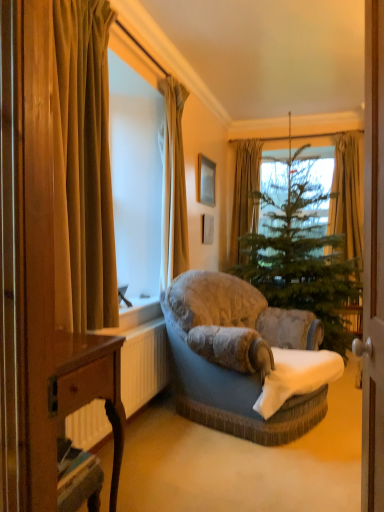
What is the approximate width of velvet gold curtain at left, arranged as the 4th curtain when viewed from the right?

velvet gold curtain at left, arranged as the 4th curtain when viewed from the right, is 20.82 centimeters wide.

This screenshot has width=384, height=512. What do you see at coordinates (142, 361) in the screenshot? I see `white plastic radiator at lower left` at bounding box center [142, 361].

What is the approximate width of wooden desk at lower left?

wooden desk at lower left is 13.41 inches wide.

Where is `green fabric curtain at upper right, which is the first curtain from right to left`? This screenshot has height=512, width=384. green fabric curtain at upper right, which is the first curtain from right to left is located at coordinates (348, 195).

Find the location of a particular element. green textured christmas tree at center is located at coordinates (302, 258).

Image resolution: width=384 pixels, height=512 pixels. Identify the location of velvet gold curtain at left, marked as the first curtain in a left-to-right arrangement. (83, 168).

Between wooden picture frame at upper center and white plastic radiator at lower left, which one has smaller width?

Thinner between the two is wooden picture frame at upper center.

Would you consider wooden picture frame at upper center to be distant from white plastic radiator at lower left?

That's right, there is a large distance between wooden picture frame at upper center and white plastic radiator at lower left.

Is wooden picture frame at upper center oriented away from white plastic radiator at lower left?

That's not correct — wooden picture frame at upper center is not looking away from white plastic radiator at lower left.

In the scene shown: Can you tell me how much wooden picture frame at upper center and white plastic radiator at lower left differ in facing direction?

wooden picture frame at upper center and white plastic radiator at lower left are facing 0.899 degrees away from each other.

In terms of height, does green fabric curtain at upper right, arranged as the 2th curtain when viewed from the back, look taller or shorter compared to green textured christmas tree at center?

Considering their sizes, green fabric curtain at upper right, arranged as the 2th curtain when viewed from the back, has less height than green textured christmas tree at center.

Is green fabric curtain at upper right, the 4th curtain when ordered from left to right, touching green textured christmas tree at center?

green fabric curtain at upper right, the 4th curtain when ordered from left to right, and green textured christmas tree at center are clearly separated.

From a real-world perspective, is green fabric curtain at upper right, which is the first curtain from right to left, under green textured christmas tree at center?

Incorrect, from a real-world perspective, green fabric curtain at upper right, which is the first curtain from right to left, is higher than green textured christmas tree at center.

Considering the sizes of green fabric curtain at upper center, the first curtain positioned from the back, and wooden desk at lower left in the image, is green fabric curtain at upper center, the first curtain positioned from the back, taller or shorter than wooden desk at lower left?

Answer: Clearly, green fabric curtain at upper center, the first curtain positioned from the back, is taller compared to wooden desk at lower left.

Is green fabric curtain at upper center, the third curtain positioned from the left, positioned with its back to wooden desk at lower left?

No, green fabric curtain at upper center, the third curtain positioned from the left, is not facing the opposite direction of wooden desk at lower left.

Choose the correct answer: Is green fabric curtain at upper center, placed as the second curtain when sorted from right to left, inside wooden desk at lower left or outside it?

green fabric curtain at upper center, placed as the second curtain when sorted from right to left, exists outside the volume of wooden desk at lower left.

Who is shorter, white plastic radiator at lower left or velvet gold curtain at left, the fourth curtain viewed from the back?

white plastic radiator at lower left is shorter.

Is velvet gold curtain at left, the fourth curtain viewed from the back, located within white plastic radiator at lower left?

No, velvet gold curtain at left, the fourth curtain viewed from the back, is located outside of white plastic radiator at lower left.

Which is closer to the camera, (x=163, y=381) or (x=67, y=138)?

The point (x=67, y=138) is in front.

Between white plastic radiator at lower left and velvet gold curtain at left, the fourth curtain viewed from the back, which one has larger size?

Bigger between the two is velvet gold curtain at left, the fourth curtain viewed from the back.

From the image's perspective, which is below, silky beige curtain at upper center, which is the second curtain in left-to-right order, or velvet gold curtain at left, arranged as the 4th curtain when viewed from the right?

velvet gold curtain at left, arranged as the 4th curtain when viewed from the right, from the image's perspective.

Based on the photo, between silky beige curtain at upper center, the third curtain in the back-to-front sequence, and velvet gold curtain at left, arranged as the 4th curtain when viewed from the right, which one appears on the left side from the viewer's perspective?

velvet gold curtain at left, arranged as the 4th curtain when viewed from the right, is more to the left.

Is silky beige curtain at upper center, marked as the third curtain in a right-to-left arrangement, bigger or smaller than velvet gold curtain at left, the fourth curtain viewed from the back?

Clearly, silky beige curtain at upper center, marked as the third curtain in a right-to-left arrangement, is smaller in size than velvet gold curtain at left, the fourth curtain viewed from the back.

Is the position of silky beige curtain at upper center, which is counted as the second curtain, starting from the front, more distant than that of velvet gold curtain at left, the fourth curtain viewed from the back?

Yes, silky beige curtain at upper center, which is counted as the second curtain, starting from the front, is further from the camera.

Where is `radiator in front of the silky beige curtain at upper center, the third curtain in the back-to-front sequence`? This screenshot has width=384, height=512. radiator in front of the silky beige curtain at upper center, the third curtain in the back-to-front sequence is located at coordinates (142, 361).

Is white plastic radiator at lower left inside silky beige curtain at upper center, marked as the third curtain in a right-to-left arrangement?

No, silky beige curtain at upper center, marked as the third curtain in a right-to-left arrangement, does not contain white plastic radiator at lower left.

Considering the sizes of objects silky beige curtain at upper center, which is the second curtain in left-to-right order, and white plastic radiator at lower left in the image provided, who is wider, silky beige curtain at upper center, which is the second curtain in left-to-right order, or white plastic radiator at lower left?

Wider between the two is silky beige curtain at upper center, which is the second curtain in left-to-right order.

Which of these two, green fabric curtain at upper center, placed as the second curtain when sorted from right to left, or velvet grey couch at center, is wider?

With larger width is velvet grey couch at center.

Does green fabric curtain at upper center, the third curtain positioned from the left, touch velvet grey couch at center?

No, green fabric curtain at upper center, the third curtain positioned from the left, is not in contact with velvet grey couch at center.

Based on the photo, is green fabric curtain at upper center, the first curtain positioned from the back, at the right side of velvet grey couch at center?

Correct, you'll find green fabric curtain at upper center, the first curtain positioned from the back, to the right of velvet grey couch at center.

Does point (242, 194) come behind point (198, 327)?

Yes, point (242, 194) is behind point (198, 327).

This screenshot has width=384, height=512. I want to click on radiator located underneath the wooden picture frame at upper center (from a real-world perspective), so click(142, 361).

Locate an element on the screen. This screenshot has width=384, height=512. the 1st curtain behind when counting from the green textured christmas tree at center is located at coordinates (348, 195).

Which object lies nearer to the anchor point white plastic radiator at lower left, velvet gold curtain at left, which is counted as the first curtain, starting from the front, or wooden picture frame at upper center?

Among the two, velvet gold curtain at left, which is counted as the first curtain, starting from the front, is located nearer to white plastic radiator at lower left.

From the image, which object appears to be farther from velvet grey couch at center, velvet gold curtain at left, marked as the first curtain in a left-to-right arrangement, or green fabric curtain at upper right, which is the first curtain from right to left?

green fabric curtain at upper right, which is the first curtain from right to left, is further to velvet grey couch at center.

Estimate the real-world distances between objects in this image. Which object is closer to green fabric curtain at upper center, the third curtain positioned from the left, green textured christmas tree at center or white plastic radiator at lower left?

Among the two, green textured christmas tree at center is located nearer to green fabric curtain at upper center, the third curtain positioned from the left.

Estimate the real-world distances between objects in this image. Which object is closer to velvet grey couch at center, wooden picture frame at upper center or silky beige curtain at upper center, the third curtain in the back-to-front sequence?

silky beige curtain at upper center, the third curtain in the back-to-front sequence, is closer to velvet grey couch at center.

Considering their positions, is wooden desk at lower left positioned further to white plastic radiator at lower left than wooden picture frame at upper center?

wooden picture frame at upper center.

Which object lies nearer to the anchor point green fabric curtain at upper center, the 4th curtain positioned from the front, wooden picture frame at upper center or velvet grey couch at center?

wooden picture frame at upper center is positioned closer to the anchor green fabric curtain at upper center, the 4th curtain positioned from the front.

From the image, which object appears to be nearer to green textured christmas tree at center, silky beige curtain at upper center, marked as the third curtain in a right-to-left arrangement, or green fabric curtain at upper center, the third curtain positioned from the left?

Among the two, green fabric curtain at upper center, the third curtain positioned from the left, is located nearer to green textured christmas tree at center.

Based on their spatial positions, is white plastic radiator at lower left or wooden picture frame at upper center closer to silky beige curtain at upper center, the third curtain in the back-to-front sequence?

Based on the image, white plastic radiator at lower left appears to be nearer to silky beige curtain at upper center, the third curtain in the back-to-front sequence.

The image size is (384, 512). In order to click on christmas tree between silky beige curtain at upper center, marked as the third curtain in a right-to-left arrangement, and green fabric curtain at upper right, arranged as the 2th curtain when viewed from the back, in the horizontal direction in this screenshot , I will do `click(302, 258)`.

Find the location of `studio couch between velvet gold curtain at left, the fourth curtain viewed from the back, and green textured christmas tree at center, along the z-axis`. studio couch between velvet gold curtain at left, the fourth curtain viewed from the back, and green textured christmas tree at center, along the z-axis is located at coordinates (236, 356).

Image resolution: width=384 pixels, height=512 pixels. I want to click on picture frame located between velvet gold curtain at left, arranged as the 4th curtain when viewed from the right, and green fabric curtain at upper right, the 4th curtain when ordered from left to right, in the depth direction, so click(x=206, y=180).

The width and height of the screenshot is (384, 512). Find the location of `picture frame between silky beige curtain at upper center, which is the second curtain in left-to-right order, and green textured christmas tree at center, in the horizontal direction`. picture frame between silky beige curtain at upper center, which is the second curtain in left-to-right order, and green textured christmas tree at center, in the horizontal direction is located at coordinates (206, 180).